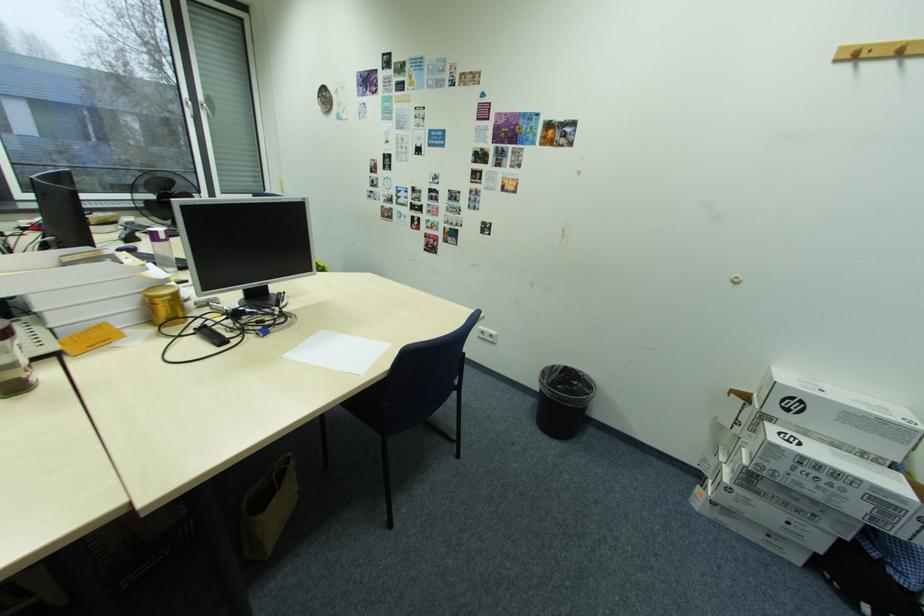
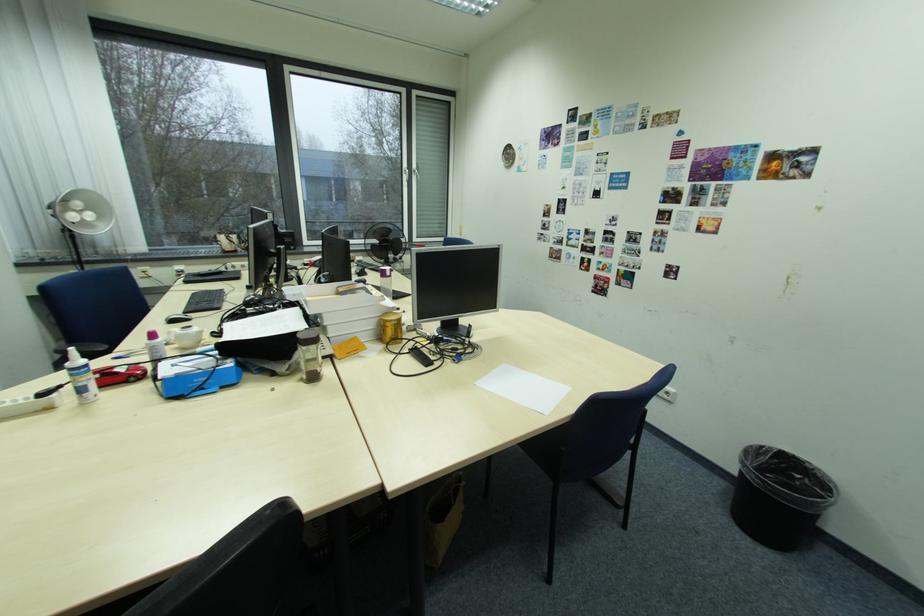
Locate, in the second image, the point that corresponds to the point at 584,384 in the first image.

(807, 477)